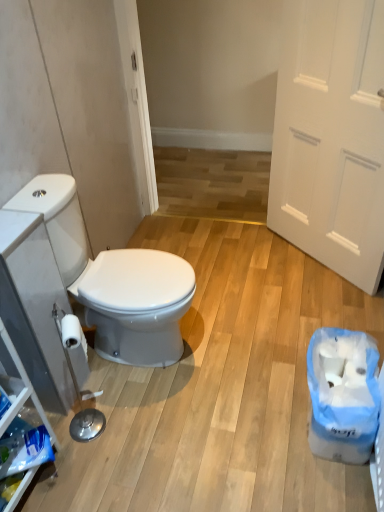
You are a GUI agent. You are given a task and a screenshot of the screen. Output one action in this format:
    pyautogui.click(x=<x>, y=<y>)
    Task: Click on the vacant space in front of white matte door at right
    The image size is (384, 512).
    Given the screenshot: What is the action you would take?
    pyautogui.click(x=307, y=309)